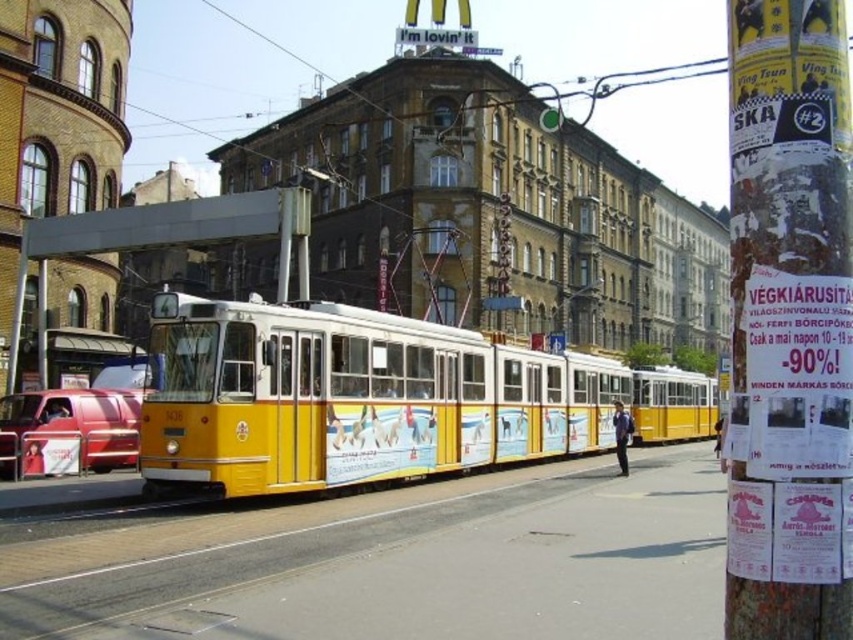
Looking at this image, you are a tourist standing on the street and want to take a photo of the paper posters at right. Where should you position yourself to ensure the posters are in the frame?

The paper posters at right are located at point (x=788, y=323), so you should position yourself to the right side of the scene to capture them in your photo.